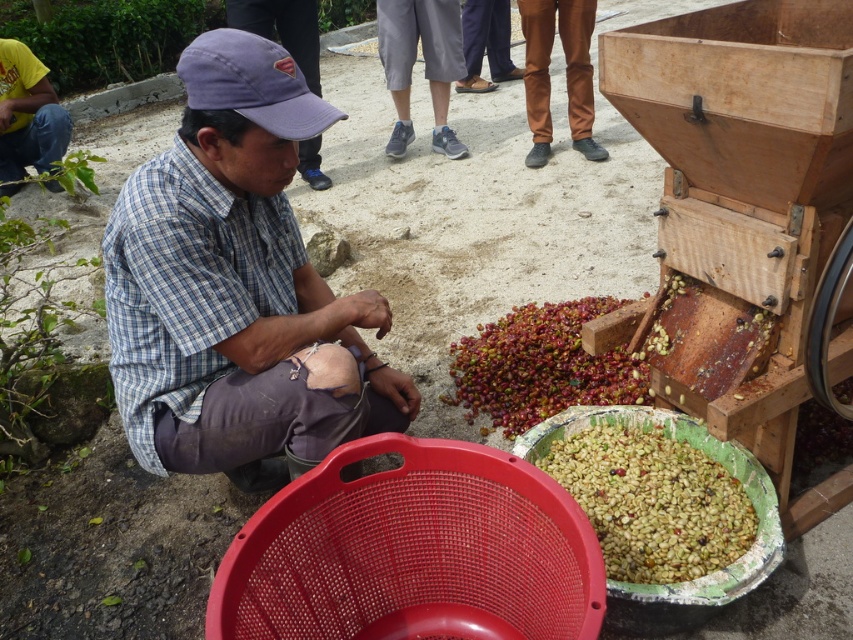
Question: Which object is positioned farthest from the brown corduroy pants at center?

Choices:
 (A) plaid shirt at center
 (B) yellow t-shirt at left
 (C) green matte coffee beans at lower center

Answer: (A)

Question: Does shiny red coffee beans at center appear over brown leather pants at center?

Choices:
 (A) yes
 (B) no

Answer: (B)

Question: Can you confirm if plaid shirt at center is wider than shiny red coffee beans at center?

Choices:
 (A) no
 (B) yes

Answer: (B)

Question: Does purple fabric cap at center have a larger size compared to brown leather pants at center?

Choices:
 (A) no
 (B) yes

Answer: (A)

Question: Estimate the real-world distances between objects in this image. Which object is closer to the green matte coffee beans at lower center?

Choices:
 (A) brown leather pants at center
 (B) brown corduroy pants at center
 (C) purple fabric cap at center

Answer: (B)

Question: Which of the following is the closest to the observer?

Choices:
 (A) yellow t-shirt at left
 (B) plaid shirt at center
 (C) brown corduroy pants at center
 (D) green matte coffee beans at lower center

Answer: (B)